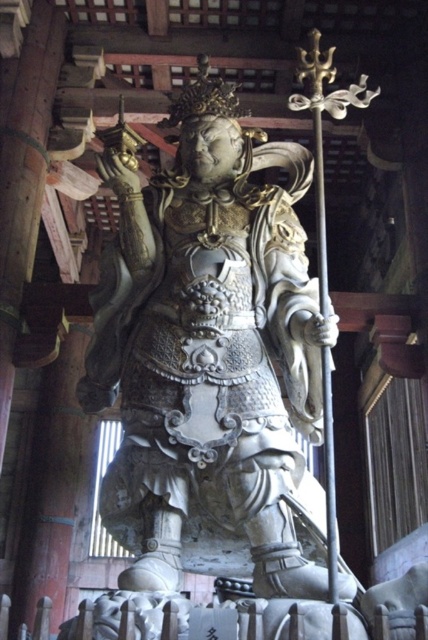
You are standing in front of the temple and see the white stone statue at center and the polished wood pole at center. Which object is positioned to the left of the other?

The white stone statue at center is to the left of polished wood pole at center.

You are an architect designing a new temple. You need to place both the white stone statue at center and the polished wood pole at center in the main hall. Given their sizes, which object should be placed closer to the entrance to ensure proper balance and visibility?

The white stone statue at center is bigger than the polished wood pole at center, so placing the statue closer to the entrance would create a more balanced and visually harmonious arrangement, as larger objects typically anchor spaces.